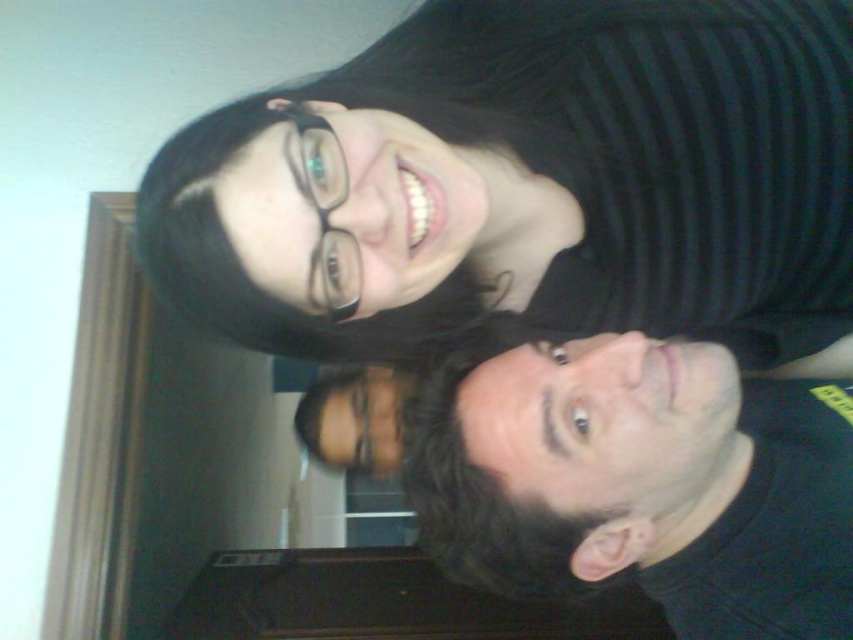
Question: Which of the following is the closest to the observer?

Choices:
 (A) (450, 451)
 (B) (811, 38)

Answer: (A)

Question: Can you confirm if black striped shirt at upper center is positioned to the left of black matte face at lower right?

Choices:
 (A) yes
 (B) no

Answer: (A)

Question: Is black striped shirt at upper center smaller than black matte face at lower right?

Choices:
 (A) yes
 (B) no

Answer: (B)

Question: Which point is closer to the camera?

Choices:
 (A) (654, 264)
 (B) (577, 442)

Answer: (B)

Question: Does black striped shirt at upper center appear on the left side of black matte face at lower right?

Choices:
 (A) yes
 (B) no

Answer: (A)